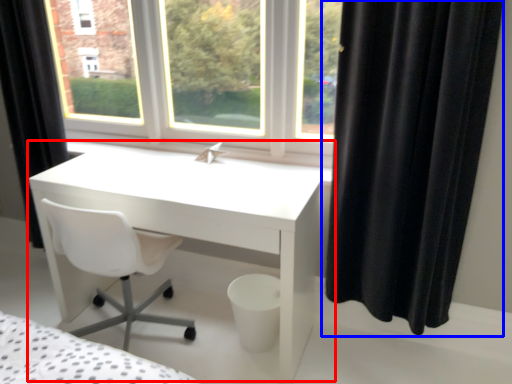
Question: Which of the following is the farthest to the observer, table (highlighted by a red box) or curtain (highlighted by a blue box)?

Choices:
 (A) table
 (B) curtain

Answer: (A)